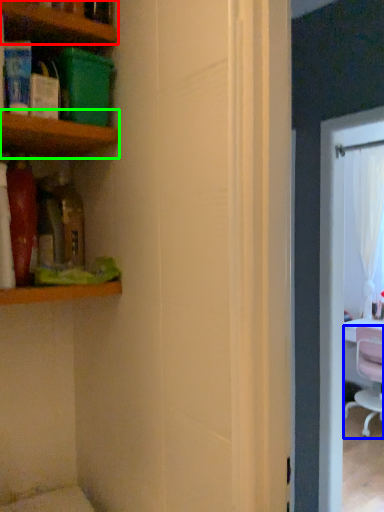
Question: Which object is positioned closest to shelf (highlighted by a red box)? Select from chair (highlighted by a blue box) and shelf (highlighted by a green box).

Choices:
 (A) chair
 (B) shelf

Answer: (B)